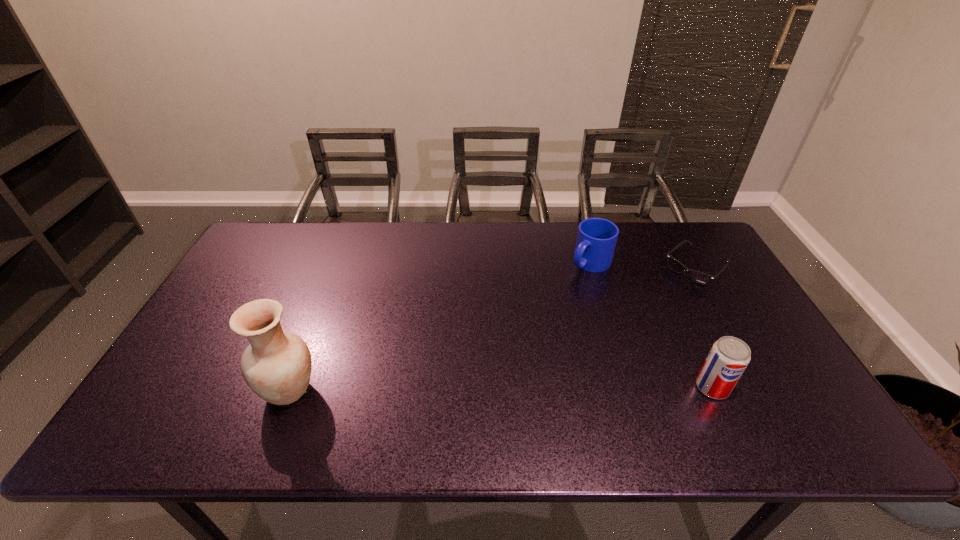
Identify the location of blank space located on the side with the handle of the third object from right to left. (531, 315).

Locate an element on the screen. free space located on the front-facing side of the shortest object is located at coordinates (x=636, y=322).

This screenshot has height=540, width=960. Identify the location of free space located 0.070m on the front-facing side of the shortest object. (668, 294).

Locate an element on the screen. vacant space located on the front-facing side of the shortest object is located at coordinates (624, 333).

Where is `mug situated at the far edge`? The height and width of the screenshot is (540, 960). mug situated at the far edge is located at coordinates (596, 240).

Locate an element on the screen. The image size is (960, 540). sunglasses that is positioned at the far edge is located at coordinates (698, 277).

Image resolution: width=960 pixels, height=540 pixels. I want to click on pottery located at the near edge, so click(277, 365).

In order to click on soda present at the near edge in this screenshot , I will do `click(729, 356)`.

At what (x,y) coordinates should I click in order to perform the action: click on object situated at the right edge. Please return your answer as a coordinate pair (x, y). Looking at the image, I should click on (698, 277).

Where is `object that is at the far right corner`? object that is at the far right corner is located at coordinates (698, 277).